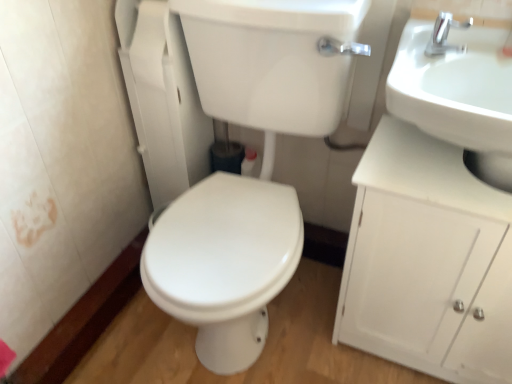
Question: Is point (350, 283) positioned closer to the camera than point (306, 0)?

Choices:
 (A) farther
 (B) closer

Answer: (A)

Question: In the image, is white matte cabinet at right on the left side or the right side of white glossy sink at upper right?

Choices:
 (A) left
 (B) right

Answer: (B)

Question: Which is farther from the white matte cabinet at right?

Choices:
 (A) silver metallic faucet at upper right
 (B) white glossy sink at upper right
 (C) white glossy sink at upper right

Answer: (A)

Question: Which of these objects is positioned farthest from the white glossy sink at upper right?

Choices:
 (A) silver metallic faucet at upper right
 (B) white glossy sink at upper right
 (C) white matte cabinet at right

Answer: (A)